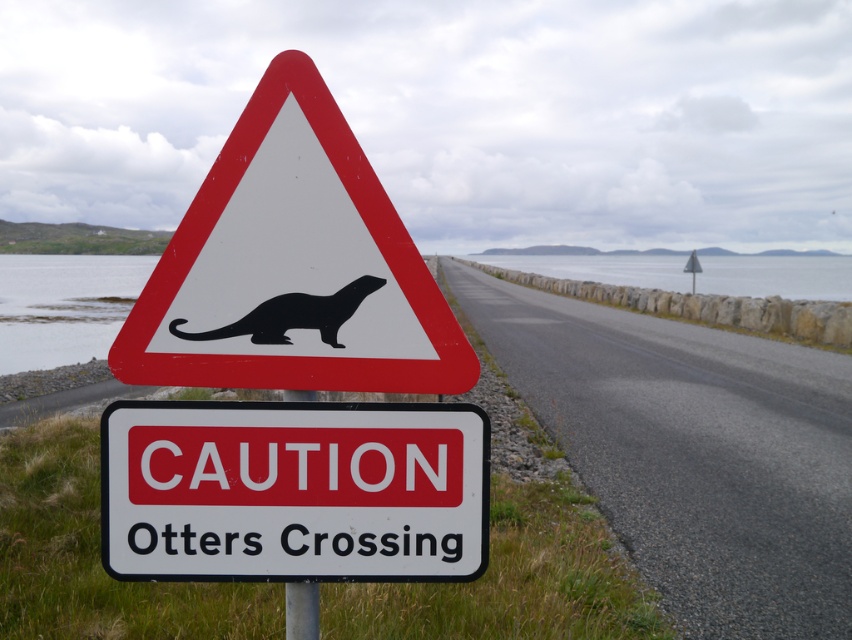
Question: Does transparent water at road center appear under black matte otter at center?

Choices:
 (A) yes
 (B) no

Answer: (B)

Question: Which point is closer to the camera?

Choices:
 (A) metallic pole at center
 (B) black plastic otter at center
 (C) black matte otter at center

Answer: (B)

Question: Can you confirm if black plastic otter at center is bigger than black matte otter at center?

Choices:
 (A) no
 (B) yes

Answer: (B)

Question: Which point is farther from the camera taking this photo?

Choices:
 (A) (245, 364)
 (B) (329, 321)
 (C) (596, 269)

Answer: (C)

Question: Does black plastic otter at center have a greater width compared to black matte otter at center?

Choices:
 (A) no
 (B) yes

Answer: (B)

Question: Among these points, which one is farthest from the camera?

Choices:
 (A) (444, 346)
 (B) (354, 298)
 (C) (294, 596)

Answer: (C)